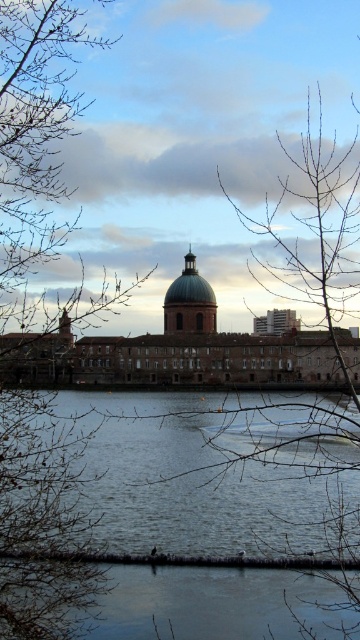
Question: Which point is closer to the camera?

Choices:
 (A) (43, 323)
 (B) (281, 456)

Answer: (A)

Question: Can you confirm if smooth water at center is smaller than bare branches at left?

Choices:
 (A) yes
 (B) no

Answer: (A)

Question: Does smooth water at center appear on the left side of bare branches at left?

Choices:
 (A) yes
 (B) no

Answer: (B)

Question: Does smooth water at center have a smaller size compared to bare branches at left?

Choices:
 (A) yes
 (B) no

Answer: (A)

Question: Among these objects, which one is farthest from the camera?

Choices:
 (A) bare branches at left
 (B) smooth water at center

Answer: (B)